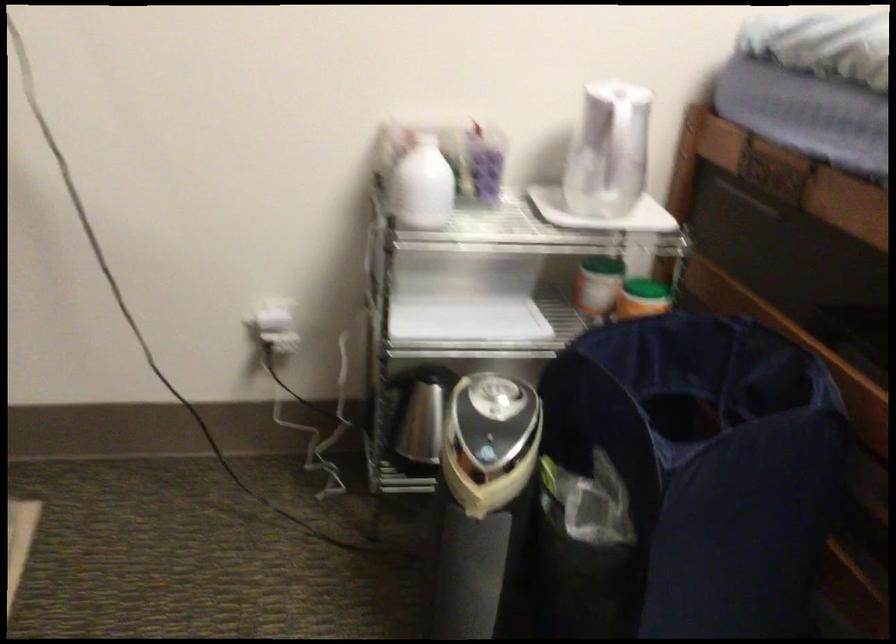
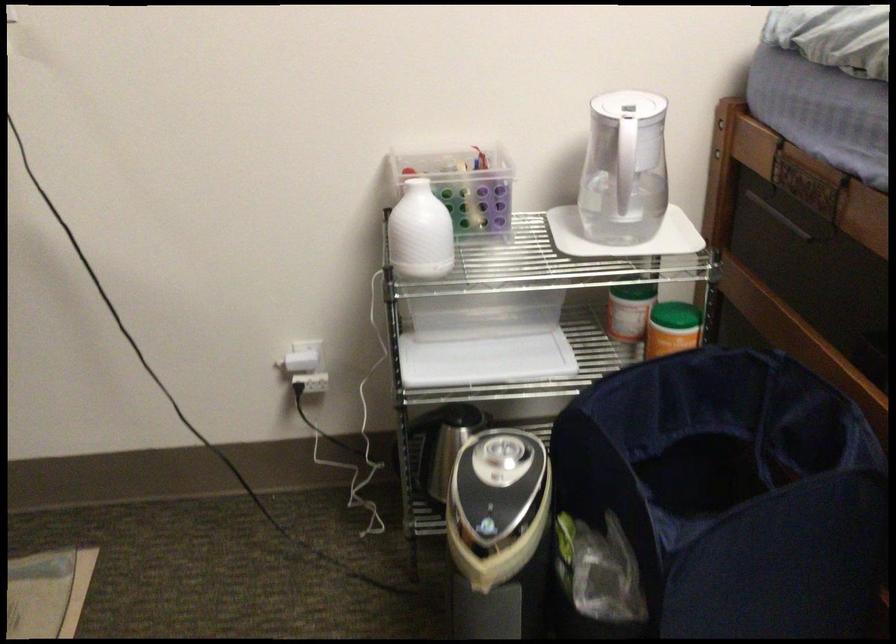
Find the pixel in the second image that matches the point at 279,322 in the first image.

(306, 366)